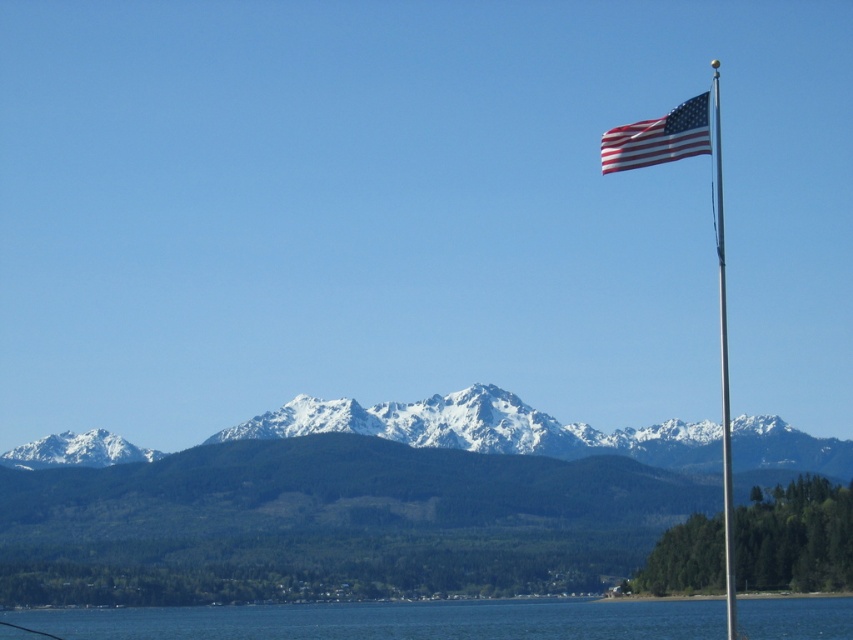
Is blue water at lower center wider than silver metallic flag pole at upper right?

Yes, blue water at lower center is wider than silver metallic flag pole at upper right.

Between point (36, 616) and point (718, 317), which one is positioned in front?

Point (36, 616) is in front.

Who is more distant from viewer, (276,614) or (721,308)?

Positioned behind is point (721,308).

You are a GUI agent. You are given a task and a screenshot of the screen. Output one action in this format:
    pyautogui.click(x=<x>, y=<y>)
    Task: Click on the blue water at lower center
    
    Given the screenshot: What is the action you would take?
    click(393, 620)

Between point (613, 145) and point (727, 401), which one is positioned behind?

The point (727, 401) is behind.

Does american flag at upper right have a smaller size compared to silver metallic flag pole at upper right?

Yes.

The image size is (853, 640). Find the location of `american flag at upper right`. american flag at upper right is located at coordinates (659, 138).

Where is `american flag at upper right`? The width and height of the screenshot is (853, 640). american flag at upper right is located at coordinates pos(659,138).

From the picture: Can you confirm if blue water at lower center is bigger than american flag at upper right?

Correct, blue water at lower center is larger in size than american flag at upper right.

Is point (810, 625) farther from camera compared to point (607, 172)?

Yes, it is behind point (607, 172).

Where is `blue water at lower center`? The height and width of the screenshot is (640, 853). blue water at lower center is located at coordinates (393, 620).